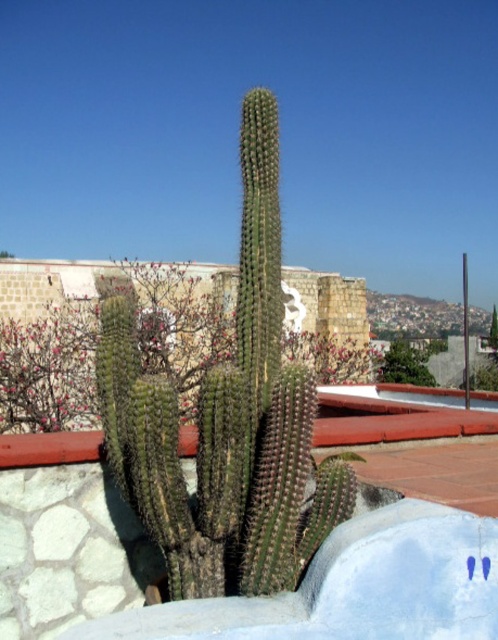
You are standing in front of a tall green cactus plant in a terracotta pot. There is a stone wall with a decorative white face in the background. If you want to place a small statue exactly halfway between the green spiny cactus at center and the edge of the stone wall, where should you place it?

The green spiny cactus at center is located at point (228, 420). To place the statue halfway between the cactus and the edge of the stone wall, you would need to calculate the midpoint between these two points. However, without knowing the exact coordinates of the wall edge, it is impossible to determine the precise location for the statue.

You are a gardener assessing the health of two cacti in a pot. You notice the green spiny cactus at center and the green spiky cactus at center. Which one is taller?

The green spiny cactus at center is taller than the green spiky cactus at center.